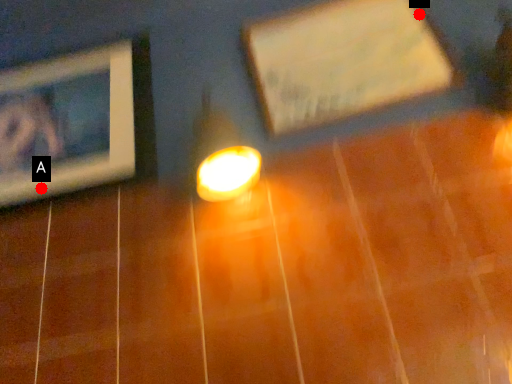
Question: Two points are circled on the image, labeled by A and B beside each circle. Among these points, which one is farthest from the camera?

Choices:
 (A) A is further
 (B) B is further

Answer: (B)